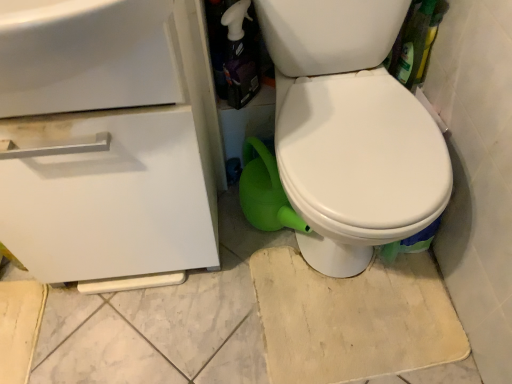
Question: From the image's perspective, is white matte drawer at left positioned above or below white glossy spray bottle at upper center?

Choices:
 (A) below
 (B) above

Answer: (A)

Question: Does point (155, 210) appear closer or farther from the camera than point (231, 87)?

Choices:
 (A) closer
 (B) farther

Answer: (A)

Question: Estimate the real-world distances between objects in this image. Which object is farther from the white matte drawer at left?

Choices:
 (A) white glossy sink at upper left
 (B) white glossy spray bottle at upper center

Answer: (B)

Question: Based on their relative distances, which object is farther from the white glossy sink at upper left?

Choices:
 (A) white matte drawer at left
 (B) white glossy spray bottle at upper center

Answer: (B)